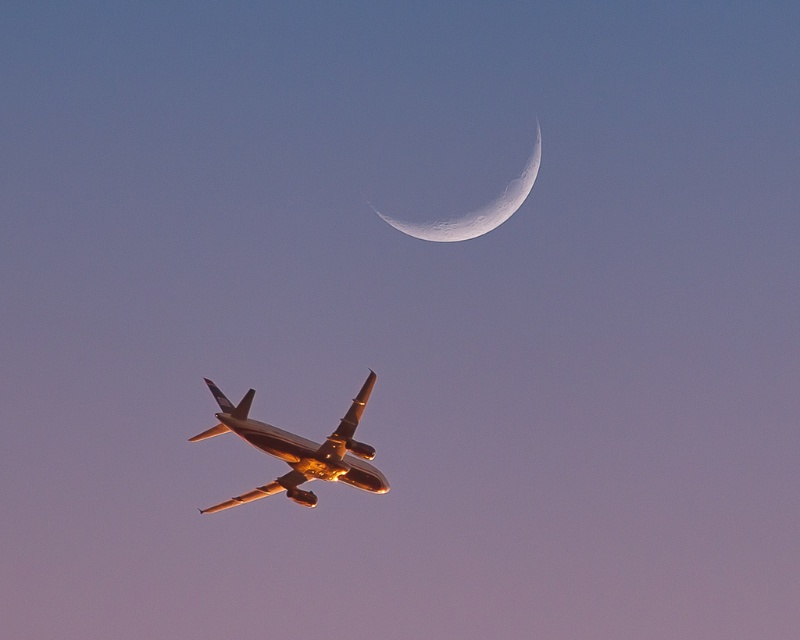
You are an air traffic controller observing the twilight sky. The runway is located at the lower left corner of the image. The metallic gold airplane at center is approaching the runway. Based on its current position, will it need to adjust its flight path to align with the runway direction?

The metallic gold airplane at center is positioned at coordinates point (300, 449), which places it on a diagonal path from the lower left to the upper right. Since the runway is at the lower left corner, the airplane is already aligned with the runway direction and does not need to adjust its flight path.

You are an astronomer observing the twilight sky. You notice a metallic gold airplane at center and a smooth white crescent at upper center. Which object is positioned more to the right in the sky?

The smooth white crescent at upper center is positioned more to the right than the metallic gold airplane at center.

You are an astronomer observing the twilight sky. You notice the metallic gold airplane at center and the smooth white crescent at upper center. Which object is located higher in the sky?

The smooth white crescent at upper center is higher in the sky than the metallic gold airplane at center.